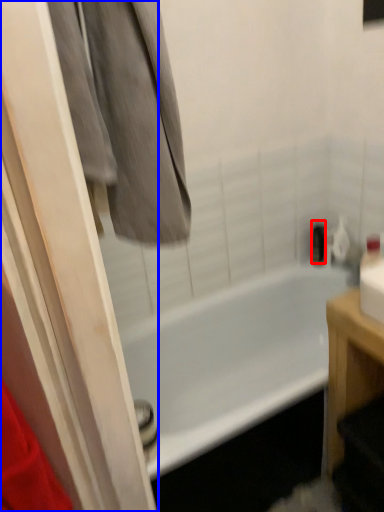
Question: Which object appears farthest to the camera in this image, toiletry (highlighted by a red box) or screen door (highlighted by a blue box)?

Choices:
 (A) toiletry
 (B) screen door

Answer: (A)